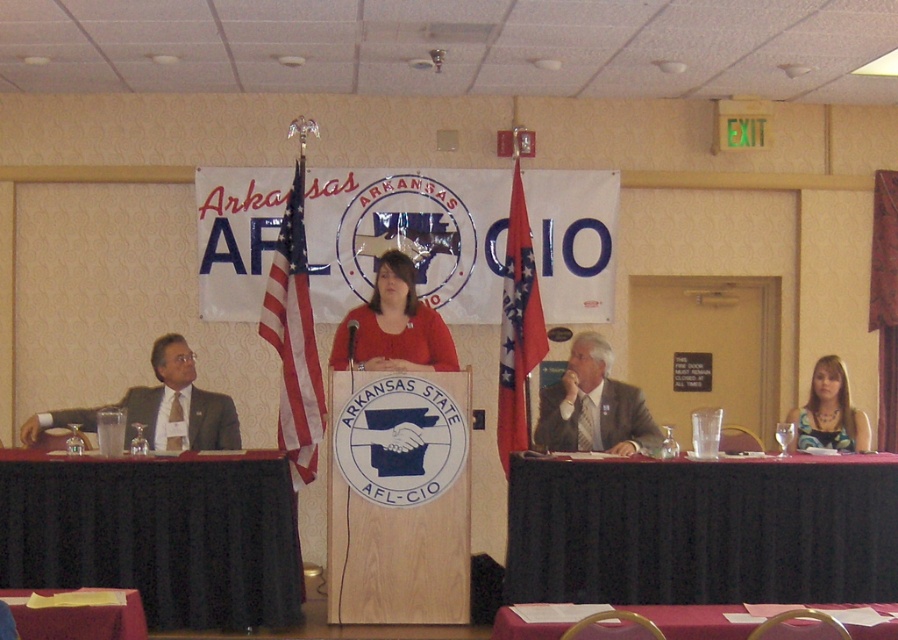
Question: Which of these objects is positioned farthest from the gray suit at center?

Choices:
 (A) matte red shirt at center
 (B) matte gray suit at left
 (C) black fabric table at lower right

Answer: (B)

Question: Which of the following is the closest to the observer?

Choices:
 (A) smooth red tablecloth at lower center
 (B) smooth red tablecloth at lower left
 (C) gray suit at center
 (D) matte gray suit at left

Answer: (A)

Question: Can you confirm if matte gray suit at left is bigger than red fabric flag at center?

Choices:
 (A) yes
 (B) no

Answer: (B)

Question: Which object is the farthest from the matte gray suit at left?

Choices:
 (A) smooth red tablecloth at lower center
 (B) red fabric flag at center
 (C) red-white striped flag at center

Answer: (A)

Question: Is black fabric table at lower left to the left of smooth red tablecloth at lower center from the viewer's perspective?

Choices:
 (A) yes
 (B) no

Answer: (A)

Question: Is gray suit at center positioned at the back of smooth red tablecloth at lower center?

Choices:
 (A) yes
 (B) no

Answer: (A)